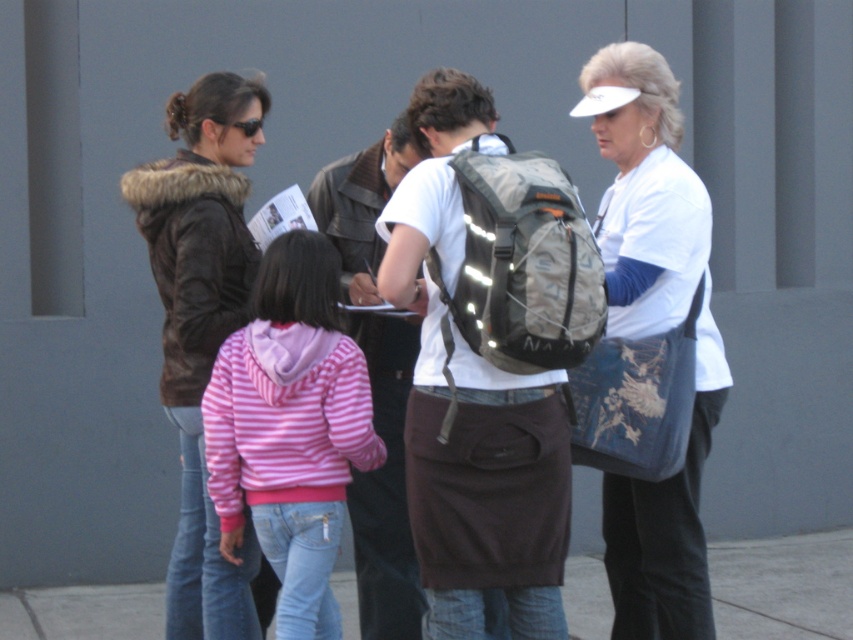
Is matte gray backpack at center wider than pink striped hoodie at center?

Yes.

How far apart are matte gray backpack at center and pink striped hoodie at center?

They are 17.00 inches apart.

Between point (422, 349) and point (334, 353), which one is positioned in front?

Point (422, 349)

The height and width of the screenshot is (640, 853). I want to click on matte gray backpack at center, so click(473, 406).

Who is positioned more to the left, matte black backpack at center or brown fur-lined jacket at left?

brown fur-lined jacket at left

Is point (625, 584) positioned in front of point (219, 320)?

No, (625, 584) is further to viewer.

Which is in front, point (618, 550) or point (184, 132)?

Point (184, 132)

This screenshot has width=853, height=640. I want to click on matte black backpack at center, so click(x=654, y=342).

This screenshot has width=853, height=640. Identify the location of matte black backpack at center. (654, 342).

Can you confirm if matte black backpack at center is thinner than white cotton shirt at center?

No, matte black backpack at center is not thinner than white cotton shirt at center.

Where is `matte black backpack at center`? This screenshot has width=853, height=640. matte black backpack at center is located at coordinates (654, 342).